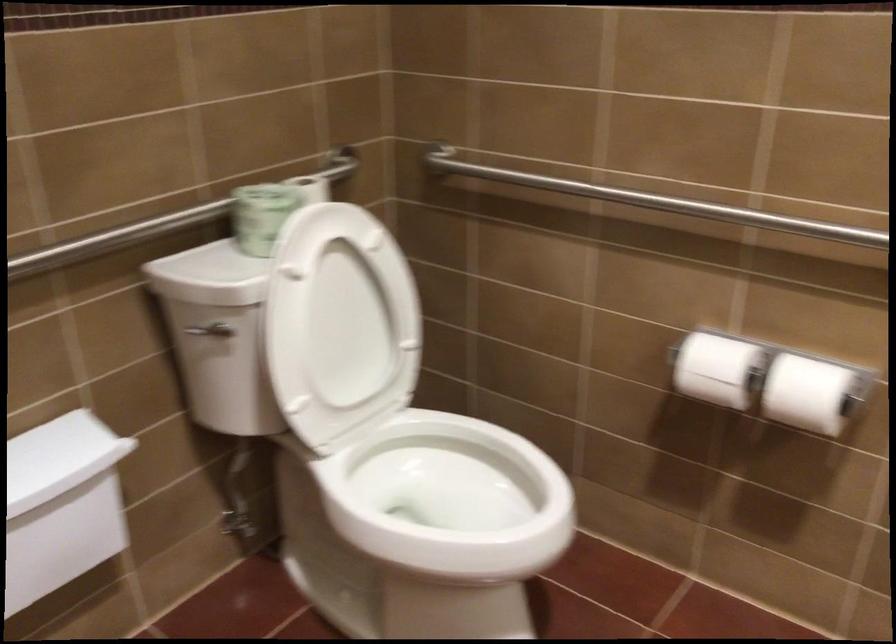
Looking at this image, based on the continuous images, in which direction is the camera rotating?

The camera rotated toward left-down.